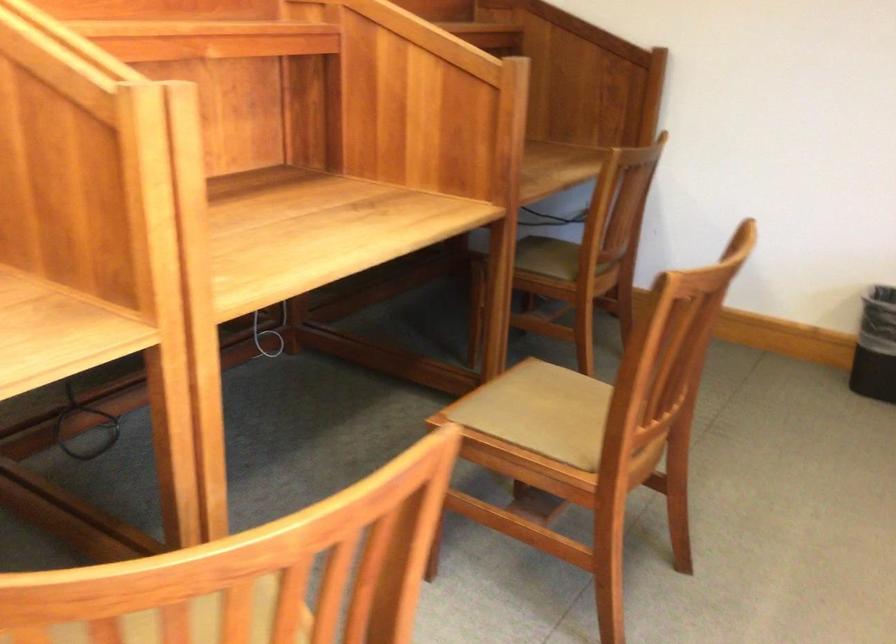
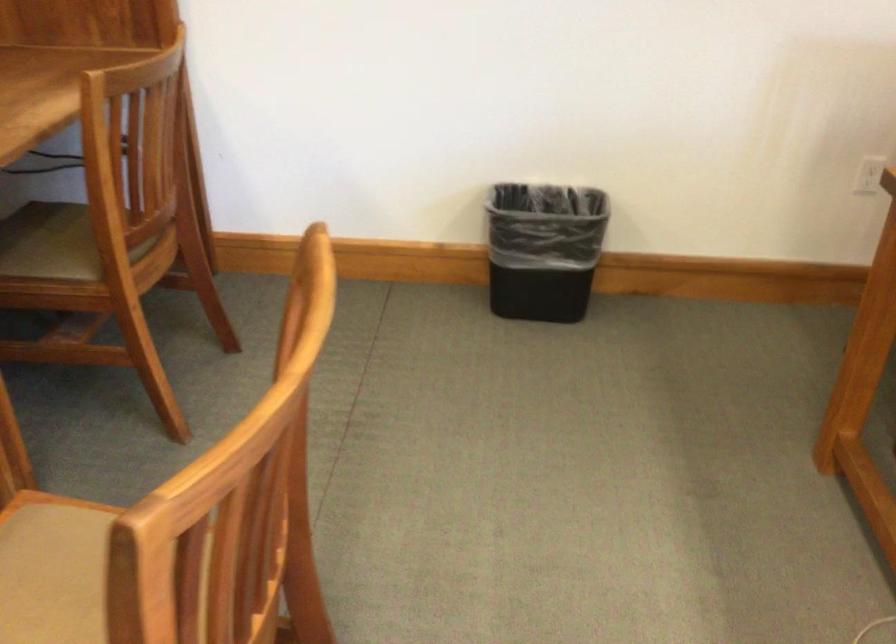
Question: The camera is either moving clockwise (left) or counter-clockwise (right) around the object. The first image is from the beginning of the video and the second image is from the end. Is the camera moving left or right when shooting the video?

Choices:
 (A) Left
 (B) Right

Answer: (A)